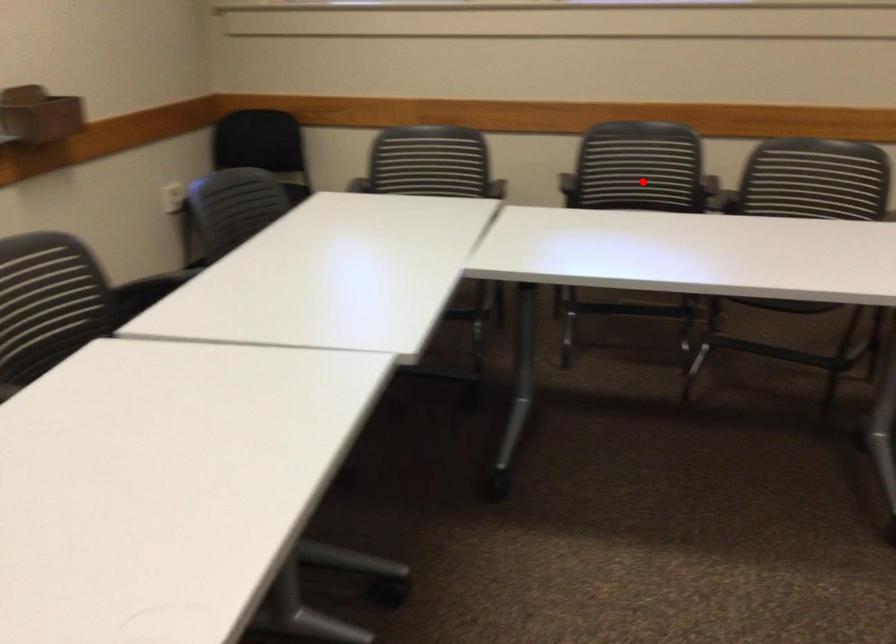
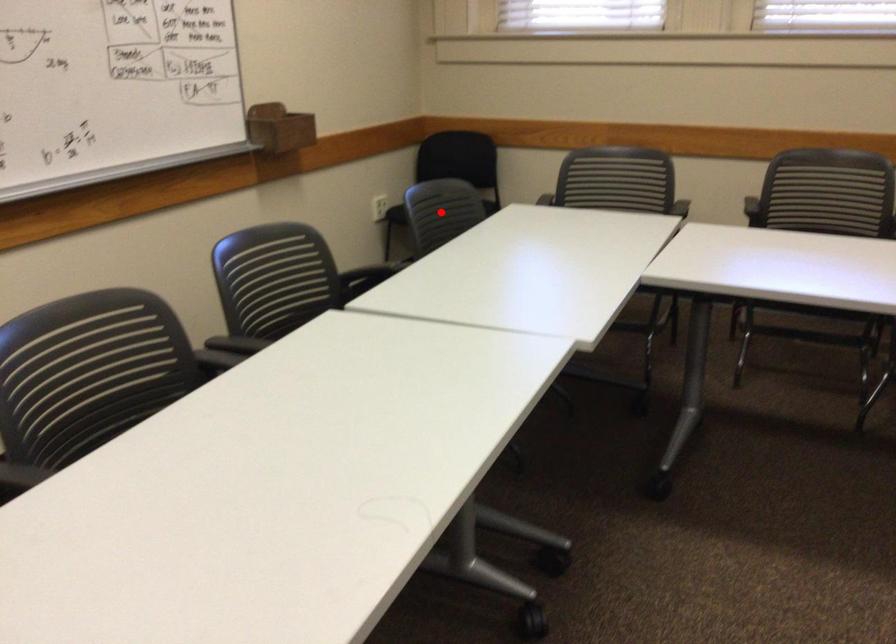
I am providing you with two images of the same scene from different viewpoints. A red point is marked on the first image and another point is marked on the second image. Is the marked point in image1 the same physical position as the marked point in image2?

No